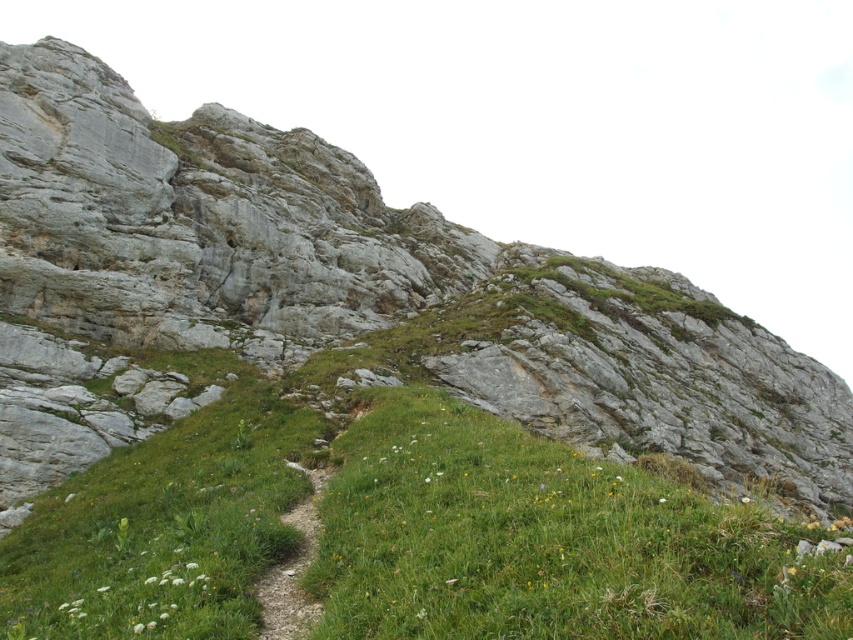
Question: Which of the following is the farthest from the observer?

Choices:
 (A) green grassy at center
 (B) white fluffy flower at lower left

Answer: (B)

Question: Which point is farther from the camera taking this photo?

Choices:
 (A) [x=135, y=586]
 (B) [x=344, y=442]

Answer: (B)

Question: From the image, what is the correct spatial relationship of green grassy at center in relation to white fluffy flower at lower left?

Choices:
 (A) left
 (B) right

Answer: (B)

Question: Does green grassy at center appear under white fluffy flower at lower left?

Choices:
 (A) yes
 (B) no

Answer: (B)

Question: Is green grassy at center below white fluffy flower at lower left?

Choices:
 (A) no
 (B) yes

Answer: (A)